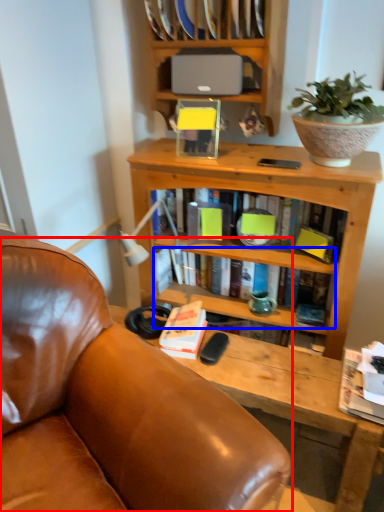
Question: Which object is closer to the camera taking this photo, chair (highlighted by a red box) or book (highlighted by a blue box)?

Choices:
 (A) chair
 (B) book

Answer: (A)